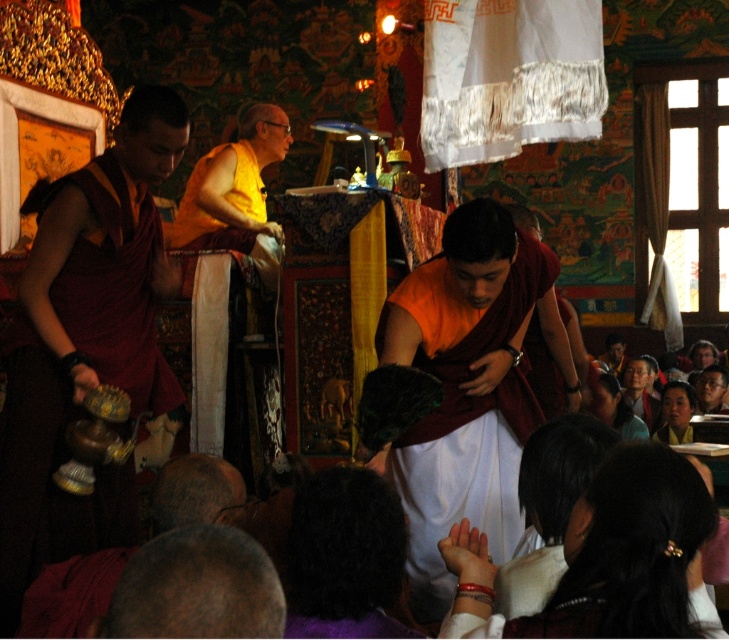
You are standing in the temple and want to take a photo of the point at coordinates (448,419). The camera you have can focus on objects up to 25 meters away. Will the point be in focus?

The distance of point (448,419) from the camera is 25.87 meters, which exceeds the camera maximum focus range of 25 meters. Therefore, the point will not be in focus.